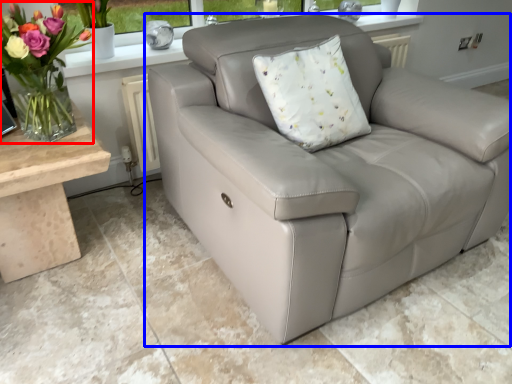
Question: Which of the following is the farthest to the observer, floral arrangement (highlighted by a red box) or studio couch (highlighted by a blue box)?

Choices:
 (A) floral arrangement
 (B) studio couch

Answer: (A)